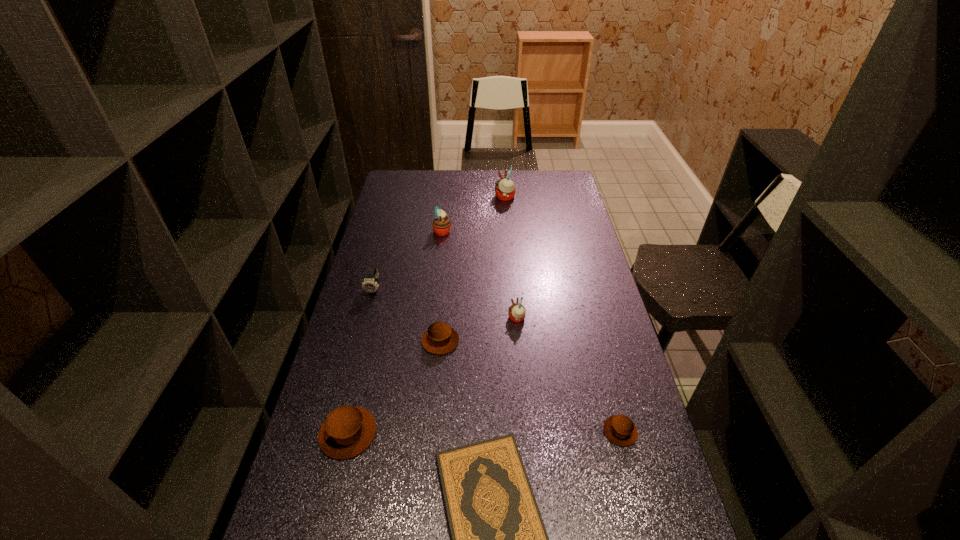
Locate an element on the screen. The width and height of the screenshot is (960, 540). the biggest pink muffin is located at coordinates (505, 189).

At what (x,y) coordinates should I click in order to perform the action: click on the farthest muffin. Please return your answer as a coordinate pair (x, y). The width and height of the screenshot is (960, 540). Looking at the image, I should click on (505, 189).

Identify the location of the leftmost pink muffin. (441, 225).

The width and height of the screenshot is (960, 540). What are the coordinates of `the fifth nearest muffin` in the screenshot? It's located at (441, 225).

You are a GUI agent. You are given a task and a screenshot of the screen. Output one action in this format:
    pyautogui.click(x=<x>, y=<y>)
    Task: Click on the sixth nearest object
    
    Given the screenshot: What is the action you would take?
    pyautogui.click(x=370, y=284)

Image resolution: width=960 pixels, height=540 pixels. In order to click on dark watch in this screenshot , I will do `click(370, 284)`.

Identify the location of the fifth nearest object. (516, 312).

I want to click on the nearest pink muffin, so click(x=516, y=312).

This screenshot has height=540, width=960. Find the location of `the leftmost muffin`. the leftmost muffin is located at coordinates (347, 431).

This screenshot has width=960, height=540. I want to click on the biggest brown muffin, so click(x=347, y=431).